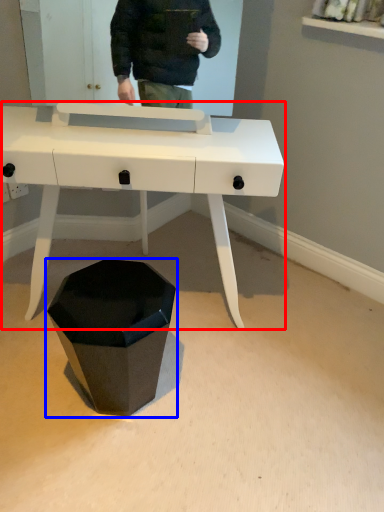
Question: Which point is closer to the camera, desk (highlighted by a red box) or waste container (highlighted by a blue box)?

Choices:
 (A) desk
 (B) waste container

Answer: (A)